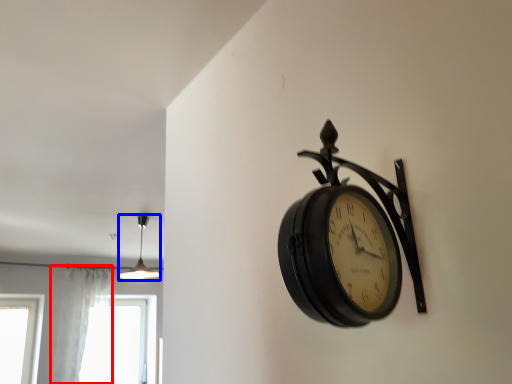
Question: Which object appears farthest to the camera in this image, curtain (highlighted by a red box) or lamp (highlighted by a blue box)?

Choices:
 (A) curtain
 (B) lamp

Answer: (A)